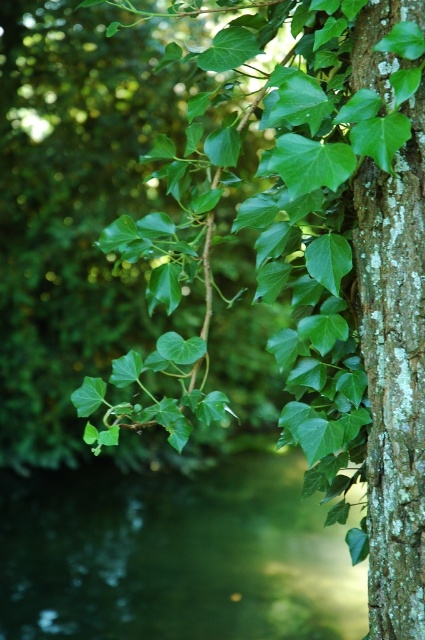
You are a gardener who needs to water the green rough bark tree trunk at right. You have a watering can with green liquid at lower left. To reach the tree trunk, should you move the watering can to the right or left?

The green liquid at lower left is already to the left of the green rough bark tree trunk at right. To reach the tree trunk, you should move the watering can to the right.

You are a gardener who needs to place a 10 feet long ladder between the green liquid at lower left and the green rough bark tree trunk at right. Can you fit the ladder horizontally between them without it touching either object?

The distance between the green liquid at lower left and the green rough bark tree trunk at right is 8.03 feet. Since the ladder is 10 feet long, which is longer than the available space, it cannot be placed horizontally between them without overlapping the objects.

You are a bird flying over the scene. You notice the green rough bark tree trunk at right and the green liquid at lower left. Which object is closer to you from your perspective?

The green liquid at lower left is closer to you because the green rough bark tree trunk at right is behind it.